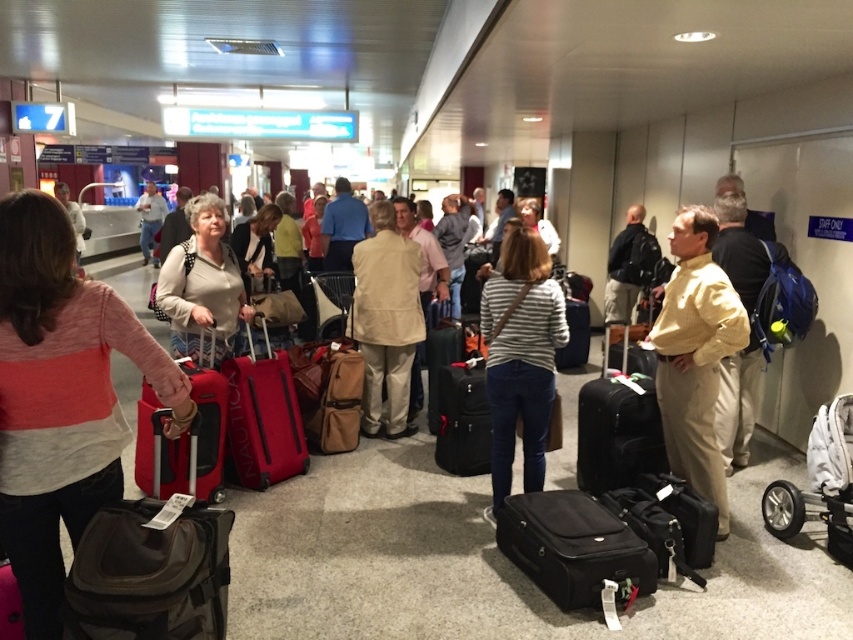
You are a traveler who just arrived at the airport. You see a red fabric suitcase at center and a brown canvas bag at center. Which one is closer to the ground?

The red fabric suitcase at center is closer to the ground because it is positioned under the brown canvas bag at center.

You are a traveler who just arrived at the airport and are looking for your luggage. You remember that your bag is smaller than the other one in the center. Which one should you choose between the red fabric suitcase at center and the brown canvas bag at center?

The brown canvas bag at center is smaller than the red fabric suitcase at center, so you should choose the brown canvas bag at center.

From the picture: You are a passenger trying to locate your luggage in the airport baggage claim area. You see the black fabric suitcase at center and the brown canvas bag at center. Which one is closer to you?

The black fabric suitcase at center is closer to you because it is in front of the brown canvas bag at center.